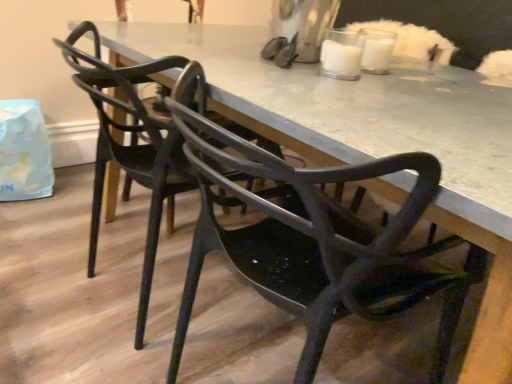
Describe the element at coordinates (314, 241) in the screenshot. I see `matte black chair at center, which is counted as the 1th chair, starting from the front` at that location.

Locate an element on the screen. The width and height of the screenshot is (512, 384). matte black chair at center, arranged as the 2th chair when viewed from the back is located at coordinates (314, 241).

This screenshot has width=512, height=384. What do you see at coordinates (352, 112) in the screenshot?
I see `matte black table at center` at bounding box center [352, 112].

What is the approximate width of matte black table at center?

37.18 inches.

What is the approximate height of matte black chair at center, placed as the 1th chair when sorted from back to front?

It is 31.34 inches.

Find the location of a particular element. This screenshot has width=512, height=384. matte black chair at center, which is counted as the 1th chair, starting from the front is located at coordinates (314, 241).

Is matte black chair at center, which is counted as the 1th chair, starting from the front, wider or thinner than matte black chair at center, placed as the 1th chair when sorted from back to front?

matte black chair at center, which is counted as the 1th chair, starting from the front, is thinner than matte black chair at center, placed as the 1th chair when sorted from back to front.

Considering the relative positions of matte black chair at center, arranged as the 2th chair when viewed from the back, and matte black chair at center, placed as the 1th chair when sorted from back to front, in the image provided, is matte black chair at center, arranged as the 2th chair when viewed from the back, to the left or to the right of matte black chair at center, placed as the 1th chair when sorted from back to front,?

From the image, it's evident that matte black chair at center, arranged as the 2th chair when viewed from the back, is to the right of matte black chair at center, placed as the 1th chair when sorted from back to front.

Is matte black chair at center, which is counted as the 1th chair, starting from the front, inside or outside of matte black chair at center, placed as the 1th chair when sorted from back to front?

matte black chair at center, which is counted as the 1th chair, starting from the front, lies outside matte black chair at center, placed as the 1th chair when sorted from back to front.

Is matte black chair at center, arranged as the 2th chair when viewed from the back, far from matte black chair at center, acting as the 2th chair starting from the front?

matte black chair at center, arranged as the 2th chair when viewed from the back, is actually quite close to matte black chair at center, acting as the 2th chair starting from the front.

Can you tell me how much matte black chair at center, arranged as the 2th chair when viewed from the back, and matte black table at center differ in facing direction?

179 degrees separate the facing orientations of matte black chair at center, arranged as the 2th chair when viewed from the back, and matte black table at center.

Is matte black chair at center, arranged as the 2th chair when viewed from the back, not near matte black table at center?

Result: They are positioned close to each other.

Based on the photo, who is bigger, matte black chair at center, which is counted as the 1th chair, starting from the front, or matte black table at center?

Bigger between the two is matte black table at center.

You are a GUI agent. You are given a task and a screenshot of the screen. Output one action in this format:
    pyautogui.click(x=<x>, y=<y>)
    Task: Click on the chair that is behind the matte black chair at center, which is counted as the 1th chair, starting from the front
    This screenshot has height=384, width=512.
    Given the screenshot: What is the action you would take?
    pyautogui.click(x=137, y=143)

From a real-world perspective, is matte black chair at center, acting as the 2th chair starting from the front, physically located above or below matte black chair at center, which is counted as the 1th chair, starting from the front?

matte black chair at center, acting as the 2th chair starting from the front, is above matte black chair at center, which is counted as the 1th chair, starting from the front.

From the image's perspective, which is below, matte black chair at center, acting as the 2th chair starting from the front, or matte black chair at center, which is counted as the 1th chair, starting from the front?

From the image's view, matte black chair at center, which is counted as the 1th chair, starting from the front, is below.

Between matte black chair at center, acting as the 2th chair starting from the front, and matte black chair at center, which is counted as the 1th chair, starting from the front, which one has larger size?

Bigger between the two is matte black chair at center, acting as the 2th chair starting from the front.

Considering the sizes of objects matte black table at center and matte black chair at center, which is counted as the 1th chair, starting from the front, in the image provided, who is wider, matte black table at center or matte black chair at center, which is counted as the 1th chair, starting from the front,?

matte black table at center.

From the image's perspective, is matte black table at center located above or below matte black chair at center, arranged as the 2th chair when viewed from the back?

matte black table at center is situated higher than matte black chair at center, arranged as the 2th chair when viewed from the back, in the image.

Between matte black chair at center, acting as the 2th chair starting from the front, and matte black table at center, which one has smaller size?

Smaller between the two is matte black chair at center, acting as the 2th chair starting from the front.

Which object is wider, matte black chair at center, acting as the 2th chair starting from the front, or matte black table at center?

With larger width is matte black table at center.

From the image's perspective, does matte black chair at center, acting as the 2th chair starting from the front, appear lower than matte black table at center?

No, from the image's perspective, matte black chair at center, acting as the 2th chair starting from the front, is not below matte black table at center.

Is matte black table at center not close to matte black chair at center, placed as the 1th chair when sorted from back to front?

matte black table at center is actually quite close to matte black chair at center, placed as the 1th chair when sorted from back to front.

Is the depth of matte black table at center greater than that of matte black chair at center, placed as the 1th chair when sorted from back to front?

No, matte black table at center is closer to the viewer.

Based on their positions, is matte black table at center located to the left or right of matte black chair at center, placed as the 1th chair when sorted from back to front?

Based on their positions, matte black table at center is located to the right of matte black chair at center, placed as the 1th chair when sorted from back to front.

From a real-world perspective, which object rests below the other?

In real-world perspective, matte black table at center is lower.

Where is `chair that is under the matte black chair at center, placed as the 1th chair when sorted from back to front (from a real-world perspective)`? chair that is under the matte black chair at center, placed as the 1th chair when sorted from back to front (from a real-world perspective) is located at coordinates (314, 241).

Identify the location of the 1st chair to the left of the matte black table at center, counting from the anchor's position. The height and width of the screenshot is (384, 512). (314, 241).

Looking at the image, which one is located closer to matte black chair at center, which is counted as the 1th chair, starting from the front, matte black chair at center, acting as the 2th chair starting from the front, or matte black table at center?

matte black table at center lies closer to matte black chair at center, which is counted as the 1th chair, starting from the front, than the other object.

Considering their positions, is matte black chair at center, placed as the 1th chair when sorted from back to front, positioned closer to matte black table at center than matte black chair at center, which is counted as the 1th chair, starting from the front?

Based on the image, matte black chair at center, which is counted as the 1th chair, starting from the front, appears to be nearer to matte black table at center.

Considering their positions, is matte black table at center positioned closer to matte black chair at center, acting as the 2th chair starting from the front, than matte black chair at center, arranged as the 2th chair when viewed from the back?

→ matte black table at center is positioned closer to the anchor matte black chair at center, acting as the 2th chair starting from the front.

From the image, which object appears to be farther from matte black chair at center, placed as the 1th chair when sorted from back to front, matte black chair at center, arranged as the 2th chair when viewed from the back, or matte black table at center?

matte black chair at center, arranged as the 2th chair when viewed from the back, lies further to matte black chair at center, placed as the 1th chair when sorted from back to front, than the other object.

From the image, which object appears to be nearer to matte black table at center, matte black chair at center, arranged as the 2th chair when viewed from the back, or matte black chair at center, placed as the 1th chair when sorted from back to front?

The object closer to matte black table at center is matte black chair at center, arranged as the 2th chair when viewed from the back.

Looking at the image, which one is located further to matte black chair at center, arranged as the 2th chair when viewed from the back, matte black table at center or matte black chair at center, acting as the 2th chair starting from the front?

matte black chair at center, acting as the 2th chair starting from the front, is positioned further to the anchor matte black chair at center, arranged as the 2th chair when viewed from the back.

Locate an element on the screen. The height and width of the screenshot is (384, 512). table between matte black chair at center, arranged as the 2th chair when viewed from the back, and matte black chair at center, acting as the 2th chair starting from the front, along the z-axis is located at coordinates (352, 112).